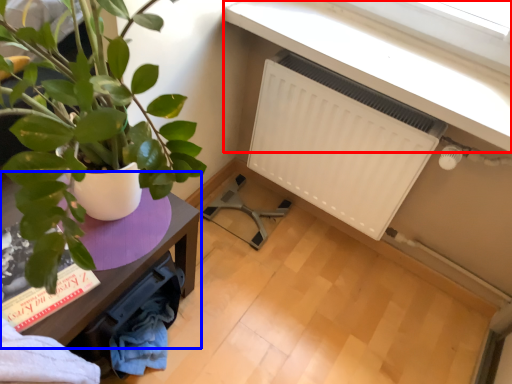
Question: Among these objects, which one is nearest to the camera, window sill (highlighted by a red box) or table (highlighted by a blue box)?

Choices:
 (A) window sill
 (B) table

Answer: (B)